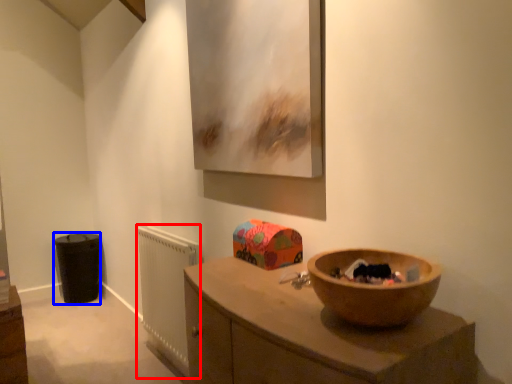
Question: Among these objects, which one is farthest to the camera, radiator (highlighted by a red box) or cabinetry (highlighted by a blue box)?

Choices:
 (A) radiator
 (B) cabinetry

Answer: (B)